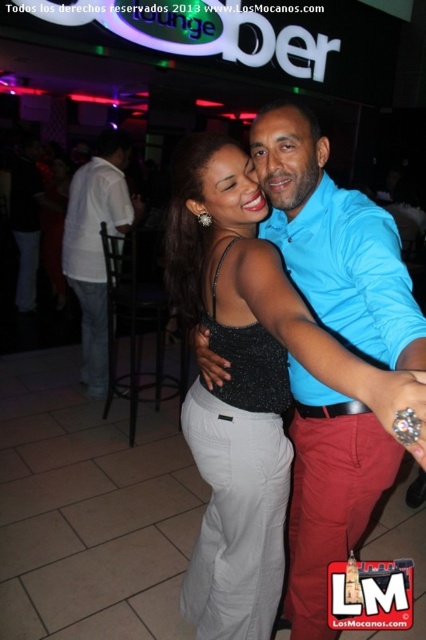
You are a photographer trying to capture the sparkly black tank top at center and the white cotton shirt at left in a single frame. Based on their positions, which one is closer to the camera?

The sparkly black tank top at center is located below the white cotton shirt at left, meaning the white cotton shirt at left is closer to the camera.